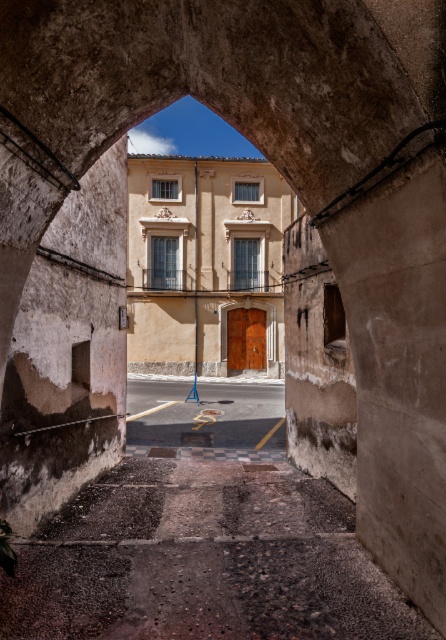
Question: Is smooth asphalt road at center closer to the viewer compared to brown wooden door at center?

Choices:
 (A) yes
 (B) no

Answer: (A)

Question: From the image, what is the correct spatial relationship of smooth asphalt road at center in relation to brown wooden door at center?

Choices:
 (A) above
 (B) below

Answer: (B)

Question: Is smooth asphalt road at center wider than brown wooden door at center?

Choices:
 (A) no
 (B) yes

Answer: (B)

Question: Which object is farther from the camera taking this photo?

Choices:
 (A) brown wooden door at center
 (B) smooth asphalt road at center

Answer: (A)